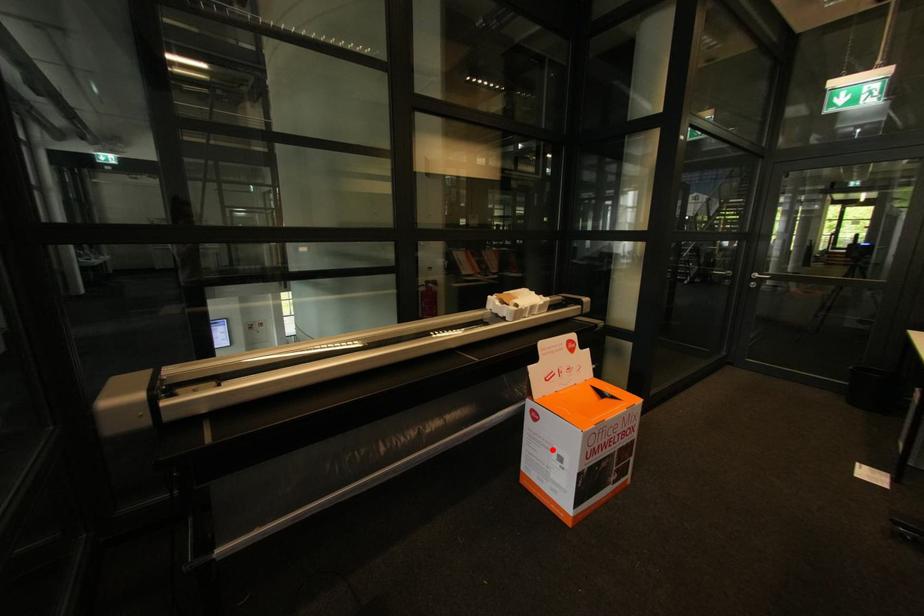
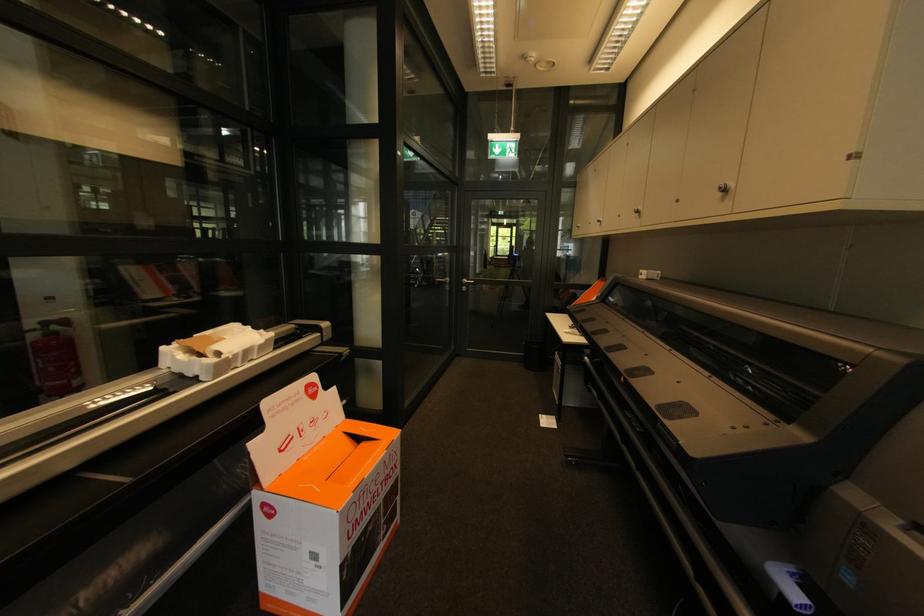
In the second image, find the point that corresponds to the highlighted location in the first image.

(299, 549)